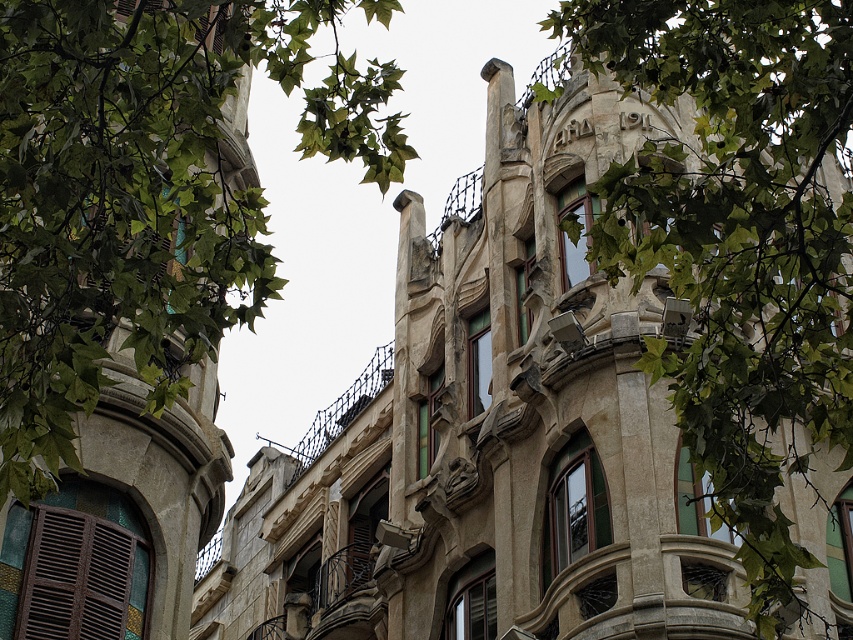
Is point (22, 1) in front of point (735, 248)?

Yes, point (22, 1) is in front of point (735, 248).

Can you confirm if green leafy branches at upper left is thinner than green leafy branches at upper center?

Yes.

Between point (381, 134) and point (805, 408), which one is positioned behind?

Positioned behind is point (805, 408).

This screenshot has height=640, width=853. What are the coordinates of `green leafy branches at upper left` in the screenshot? It's located at (144, 193).